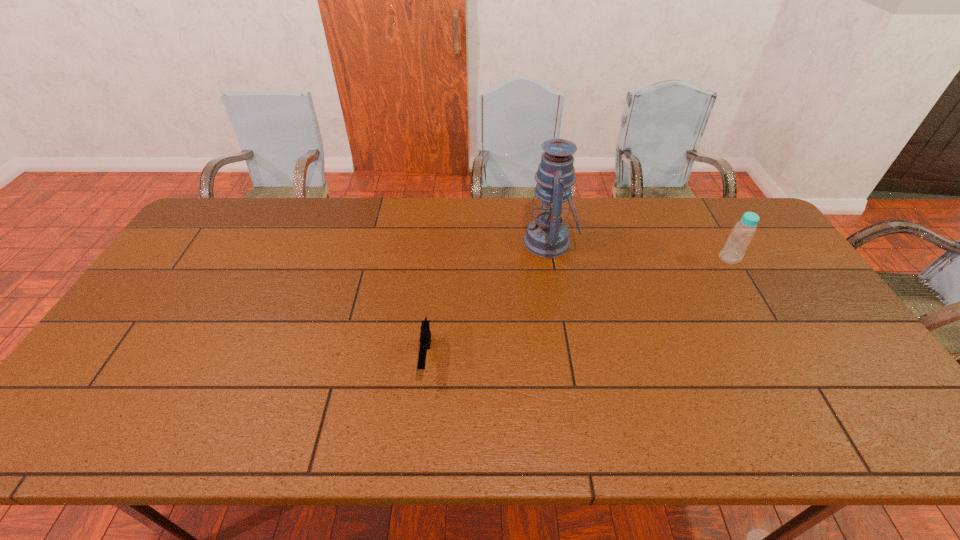
Where is `vacant space that is in between the lantern and the nearest object`? vacant space that is in between the lantern and the nearest object is located at coordinates (488, 300).

This screenshot has width=960, height=540. I want to click on unoccupied position between the second tallest object and the nearest object, so click(578, 308).

You are a GUI agent. You are given a task and a screenshot of the screen. Output one action in this format:
    pyautogui.click(x=<x>, y=<y>)
    Task: Click on the free area in between the rightmost object and the second object from left to right
    The image size is (960, 540).
    Given the screenshot: What is the action you would take?
    pyautogui.click(x=639, y=250)

Where is `empty space that is in between the tallest object and the bottle`? empty space that is in between the tallest object and the bottle is located at coordinates (639, 250).

Where is `empty space between the rightmost object and the lantern`? The height and width of the screenshot is (540, 960). empty space between the rightmost object and the lantern is located at coordinates pyautogui.click(x=639, y=250).

This screenshot has height=540, width=960. I want to click on free area in between the lantern and the pistol, so click(x=488, y=300).

Locate an element on the screen. The image size is (960, 540). vacant area between the bottle and the second object from right to left is located at coordinates (639, 250).

Image resolution: width=960 pixels, height=540 pixels. I want to click on vacant area between the shortest object and the bottle, so click(578, 308).

Identify which object is located as the nearest to the second tallest object. Please provide its 2D coordinates. Your answer should be formatted as a tuple, i.e. [(x, y)], where the tuple contains the x and y coordinates of a point satisfying the conditions above.

[(547, 236)]

The height and width of the screenshot is (540, 960). I want to click on object identified as the closest to the shortest object, so click(x=547, y=236).